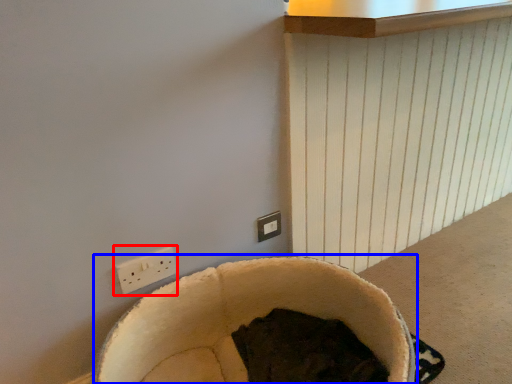
Question: Which point is further to the camera, power plugs and sockets (highlighted by a red box) or bean bag chair (highlighted by a blue box)?

Choices:
 (A) power plugs and sockets
 (B) bean bag chair

Answer: (A)